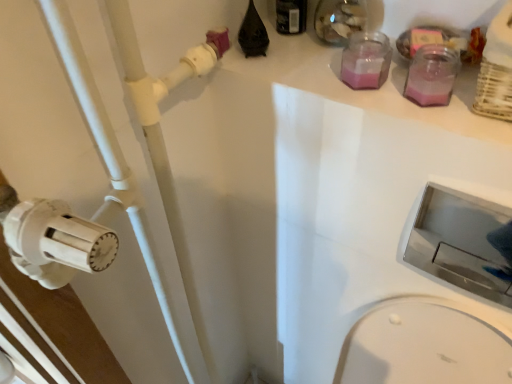
Question: In the image, is white plastic pipe at left positioned in front of or behind metallic silver sink at lower right?

Choices:
 (A) behind
 (B) front

Answer: (B)

Question: In the image, is white plastic pipe at left on the left side or the right side of metallic silver sink at lower right?

Choices:
 (A) left
 (B) right

Answer: (A)

Question: Based on their relative distances, which object is nearer to the metallic silver sink at lower right?

Choices:
 (A) pink glass jar at upper right, acting as the 1th bottle starting from the bottom
 (B) white plastic pipe at left
 (C) black plastic bottle at upper center, which is the 2th bottle in right-to-left order

Answer: (B)

Question: Estimate the real-world distances between objects in this image. Which object is closer to the black plastic bottle at upper center, which is the first bottle in top-to-bottom order?

Choices:
 (A) pink glass jar at upper right, which ranks as the 1th bottle in right-to-left order
 (B) white plastic pipe at left
 (C) metallic silver sink at lower right

Answer: (A)